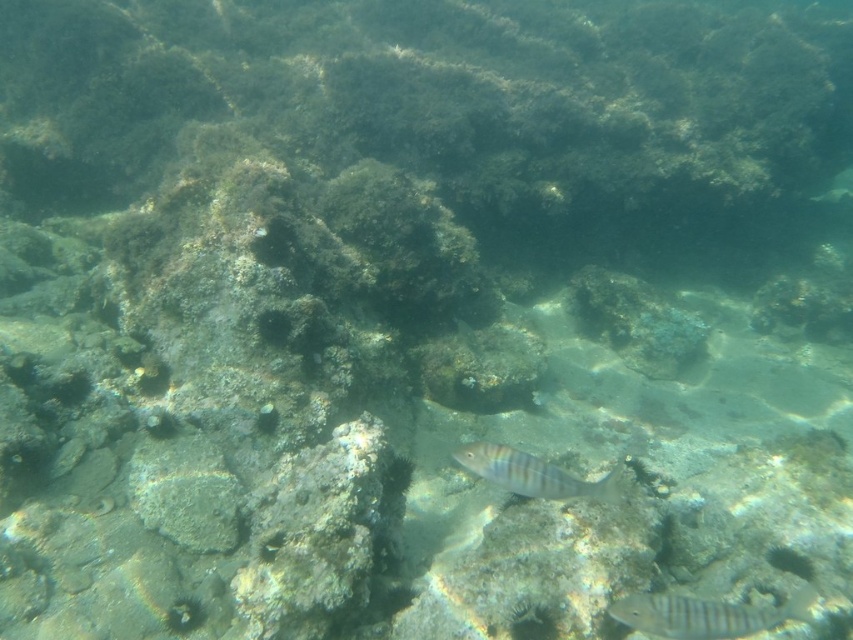
Is striped silver fish at center shorter than shiny silver fish at center?

No.

Image resolution: width=853 pixels, height=640 pixels. I want to click on striped silver fish at center, so click(x=706, y=614).